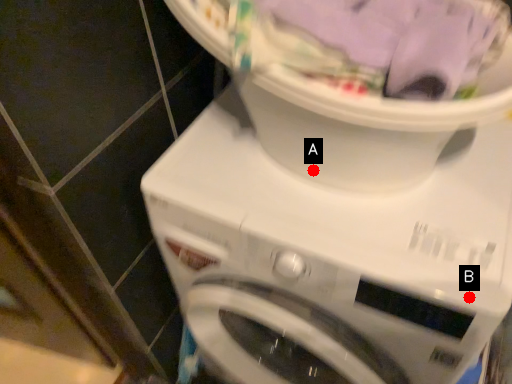
Question: Two points are circled on the image, labeled by A and B beside each circle. Which of the following is the farthest from the observer?

Choices:
 (A) A is further
 (B) B is further

Answer: (A)